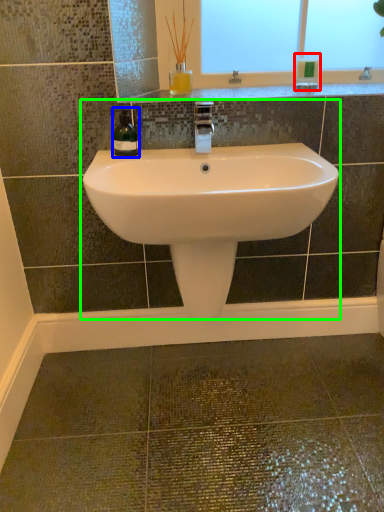
Question: Estimate the real-world distances between objects in this image. Which object is farther from toiletry (highlighted by a red box), wine bottle (highlighted by a blue box) or sink (highlighted by a green box)?

Choices:
 (A) wine bottle
 (B) sink

Answer: (A)